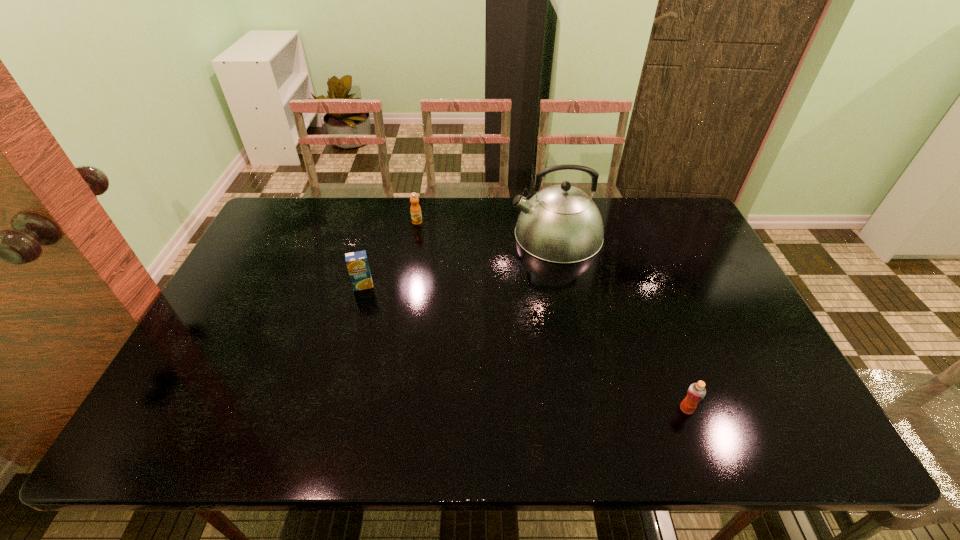
Image resolution: width=960 pixels, height=540 pixels. I want to click on vacant region between the rightmost object and the second nearest orange juice, so click(525, 347).

Where is `free space between the rightmost orange juice and the leftmost object`? This screenshot has width=960, height=540. free space between the rightmost orange juice and the leftmost object is located at coordinates (525, 347).

Identify the location of free spot between the third farthest object and the nearest object. (525, 347).

In order to click on object that is the third closest to the tallest object in this screenshot , I will do `click(696, 392)`.

The width and height of the screenshot is (960, 540). Find the location of `object that stands as the third closest to the second orange juice from left to right`. object that stands as the third closest to the second orange juice from left to right is located at coordinates (696, 392).

You are a GUI agent. You are given a task and a screenshot of the screen. Output one action in this format:
    pyautogui.click(x=<x>, y=<y>)
    Task: Click on the second closest orange juice to the third farthest object
    Image resolution: width=960 pixels, height=540 pixels.
    Given the screenshot: What is the action you would take?
    pyautogui.click(x=696, y=392)

Select which orange juice is the second closest to the kettle. Please provide its 2D coordinates. Your answer should be formatted as a tuple, i.e. [(x, y)], where the tuple contains the x and y coordinates of a point satisfying the conditions above.

[(357, 263)]

What are the coordinates of `vacant region that satisfies the following two spatial constraints: 1. on the front side of the leftmost object; 2. on the left side of the rightmost orange juice` in the screenshot? It's located at (330, 409).

At what (x,y) coordinates should I click in order to perform the action: click on vacant space that satisfies the following two spatial constraints: 1. on the front label of the second orange juice from left to right; 2. on the right side of the rightmost object. Please return your answer as a coordinate pair (x, y). Looking at the image, I should click on (386, 409).

You are a GUI agent. You are given a task and a screenshot of the screen. Output one action in this format:
    pyautogui.click(x=<x>, y=<y>)
    Task: Click on the vacant position in the image that satisfies the following two spatial constraints: 1. from the spout of the tallest object; 2. on the right side of the rightmost orange juice
    This screenshot has height=540, width=960.
    Given the screenshot: What is the action you would take?
    pyautogui.click(x=591, y=409)